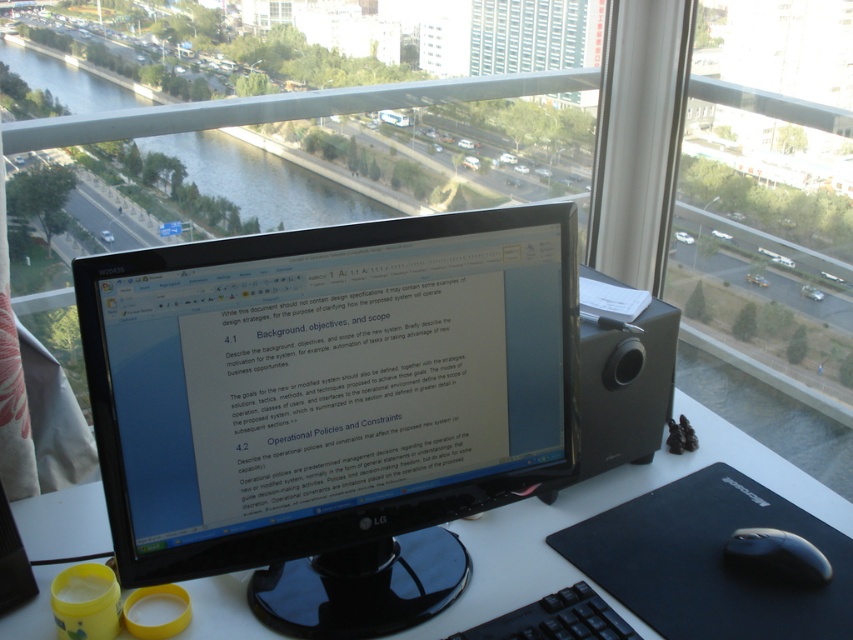
Question: Can you confirm if transparent glass window at upper center is positioned below black plastic keyboard at lower center?

Choices:
 (A) no
 (B) yes

Answer: (A)

Question: Does black rubber mouse at lower right have a larger size compared to black matte mouse at lower right?

Choices:
 (A) no
 (B) yes

Answer: (B)

Question: Estimate the real-world distances between objects in this image. Which object is closer to the black plastic keyboard at lower center?

Choices:
 (A) transparent glass window at upper center
 (B) white plastic computer desk at center

Answer: (B)

Question: Does white plastic computer desk at center appear under black matte mouse at lower right?

Choices:
 (A) yes
 (B) no

Answer: (B)

Question: Which point is farther from the camera taking this photo?

Choices:
 (A) (734, 499)
 (B) (579, 625)

Answer: (A)

Question: Considering the real-world distances, which object is closest to the white plastic computer desk at center?

Choices:
 (A) black glossy monitor at center
 (B) black plastic keyboard at lower center
 (C) black rubber mouse at lower right

Answer: (C)